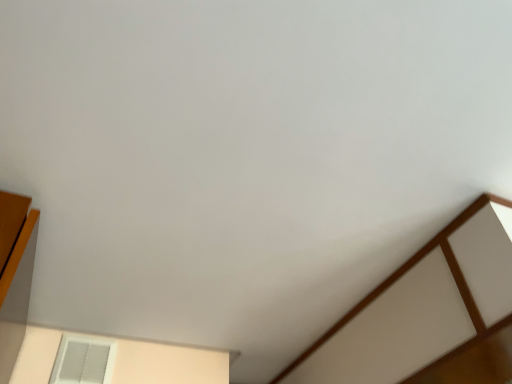
Locate an element on the screen. wooden paneling at right is located at coordinates (426, 311).

What do you see at coordinates (426, 311) in the screenshot? I see `wooden paneling at right` at bounding box center [426, 311].

Identify the location of white textured window at lower left. (83, 360).

What do you see at coordinates (83, 360) in the screenshot?
I see `white textured window at lower left` at bounding box center [83, 360].

Locate an element on the screen. The width and height of the screenshot is (512, 384). wooden paneling at right is located at coordinates (426, 311).

Consider the image. Which is more to the right, wooden paneling at right or white textured window at lower left?

From the viewer's perspective, wooden paneling at right appears more on the right side.

Is wooden paneling at right positioned before white textured window at lower left?

Yes, it is in front of white textured window at lower left.

Which is in front, point (499, 231) or point (110, 365)?

The point (499, 231) is closer.

From the image's perspective, between wooden paneling at right and white textured window at lower left, who is located below?

wooden paneling at right is shown below in the image.

Consider the image. From a real-world perspective, is wooden paneling at right located beneath white textured window at lower left?

Yes, from a real-world perspective, wooden paneling at right is under white textured window at lower left.

Looking at this image, which object is thinner, wooden paneling at right or white textured window at lower left?

white textured window at lower left is thinner.

Who is shorter, wooden paneling at right or white textured window at lower left?

With less height is white textured window at lower left.

Who is smaller, wooden paneling at right or white textured window at lower left?

With smaller size is white textured window at lower left.

Can we say wooden paneling at right lies outside white textured window at lower left?

wooden paneling at right lies outside white textured window at lower left's area.

Looking at this image, are wooden paneling at right and white textured window at lower left far apart?

No, wooden paneling at right is not far away from white textured window at lower left.

Could you tell me if wooden paneling at right is turned towards white textured window at lower left?

No, wooden paneling at right does not turn towards white textured window at lower left.

How different are the orientations of wooden paneling at right and white textured window at lower left in degrees?

1.01 degrees.

There is a wooden paneling at right. Where is `window above it (from a real-world perspective)`? The width and height of the screenshot is (512, 384). window above it (from a real-world perspective) is located at coordinates (83, 360).

Considering the positions of objects white textured window at lower left and wooden paneling at right in the image provided, who is more to the left, white textured window at lower left or wooden paneling at right?

Positioned to the left is white textured window at lower left.

Is white textured window at lower left positioned behind wooden paneling at right?

That is True.

Does point (85, 366) come behind point (434, 310)?

Yes, it is.

From the image's perspective, relative to wooden paneling at right, is white textured window at lower left above or below?

Clearly, from the image's perspective, white textured window at lower left is above wooden paneling at right.

Looking at this image, from a real-world perspective, between white textured window at lower left and wooden paneling at right, who is vertically higher?

white textured window at lower left is physically above.

Considering the sizes of white textured window at lower left and wooden paneling at right in the image, is white textured window at lower left wider or thinner than wooden paneling at right?

white textured window at lower left is thinner than wooden paneling at right.

Can you confirm if white textured window at lower left is taller than wooden paneling at right?

Incorrect, the height of white textured window at lower left is not larger of that of wooden paneling at right.

Is white textured window at lower left bigger than wooden paneling at right?

No, white textured window at lower left is not bigger than wooden paneling at right.

Looking at this image, can wooden paneling at right be found inside white textured window at lower left?

No, wooden paneling at right is not a part of white textured window at lower left.

Is white textured window at lower left next to wooden paneling at right and touching it?

white textured window at lower left and wooden paneling at right are clearly separated.

Is white textured window at lower left oriented away from wooden paneling at right?

That's not correct — white textured window at lower left is not looking away from wooden paneling at right.

What are the coordinates of `window above the wooden paneling at right (from the image's perspective)` in the screenshot? It's located at (83, 360).

Locate an element on the screen. Image resolution: width=512 pixels, height=384 pixels. window above the wooden paneling at right (from the image's perspective) is located at coordinates (83, 360).

This screenshot has width=512, height=384. What are the coordinates of `furniture that appears below the white textured window at lower left (from a real-world perspective)` in the screenshot? It's located at (426, 311).